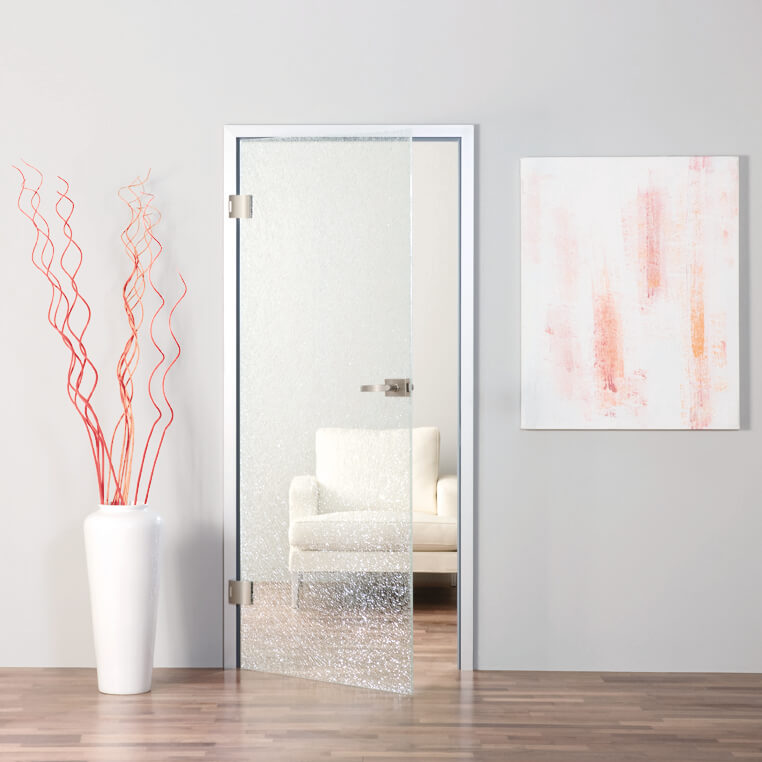
Find the location of `floor`. floor is located at coordinates (652, 751), (79, 721).